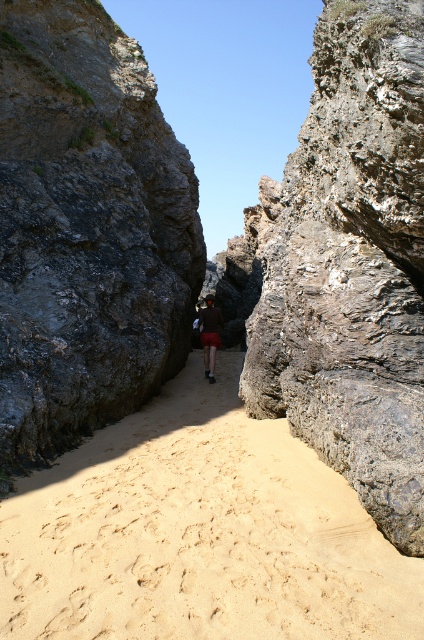
Question: Which of the following is the farthest from the observer?

Choices:
 (A) rough gray rock at center
 (B) dark gray rocky cliff at center
 (C) beige sandy path at center
 (D) dark brown leather jacket at center

Answer: (D)

Question: Does rough gray rock at center have a lesser width compared to dark brown leather jacket at center?

Choices:
 (A) no
 (B) yes

Answer: (A)

Question: Which point is farther from the camera taking this photo?

Choices:
 (A) (66, 65)
 (B) (418, 483)

Answer: (A)

Question: Among these points, which one is farthest from the camera?

Choices:
 (A) (211, 342)
 (B) (334, 636)

Answer: (A)

Question: Does rough gray rock at center have a greater width compared to dark brown leather jacket at center?

Choices:
 (A) yes
 (B) no

Answer: (A)

Question: Is dark gray rocky cliff at center positioned in front of dark brown leather jacket at center?

Choices:
 (A) no
 (B) yes

Answer: (B)